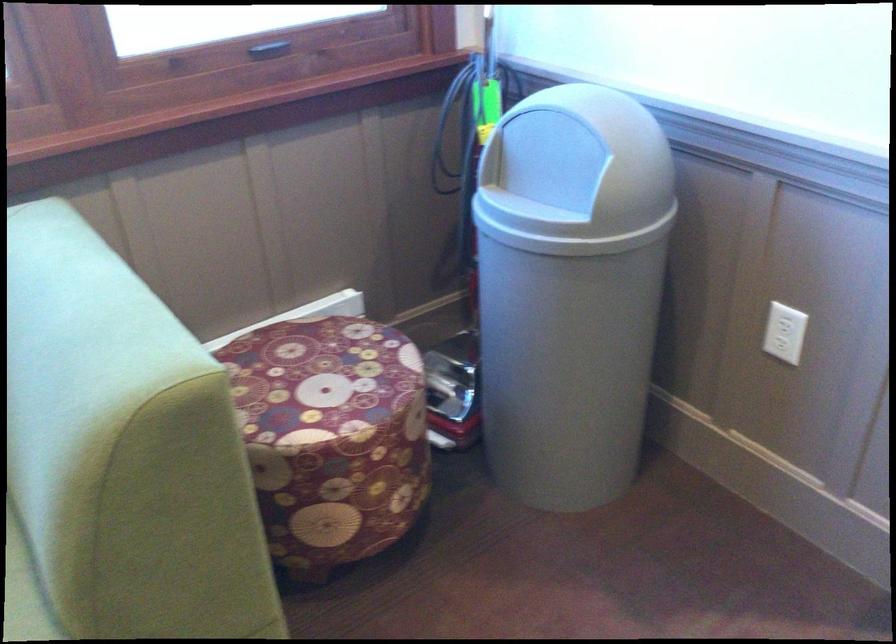
Describe the element at coordinates (550, 174) in the screenshot. I see `a gray trash can lid` at that location.